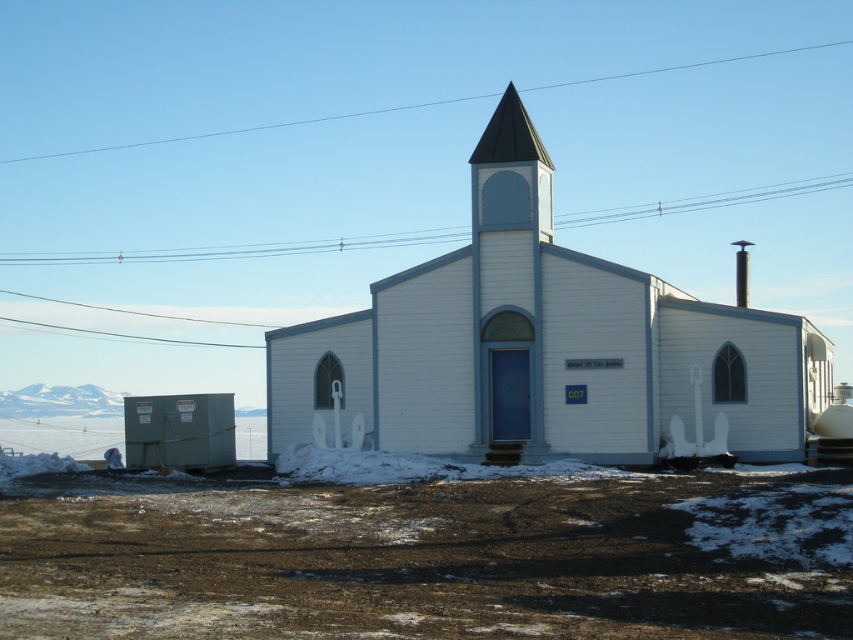
You are standing in front of the white wood church at center and want to touch both the shiny dark gray spire at center and the church walls. Which one can you reach first without moving your position?

The white wood church at center is closer to the viewer than the shiny dark gray spire at center, so you can reach the white wood church at center first without moving.

You are standing at the origin point in the snowy landscape. The white wood church at center is marked at coordinates. Which direction should you face to see the church?

The white wood church at center is located at point (543, 342), so you should face northeast to see it since the coordinates are in the northeast quadrant.